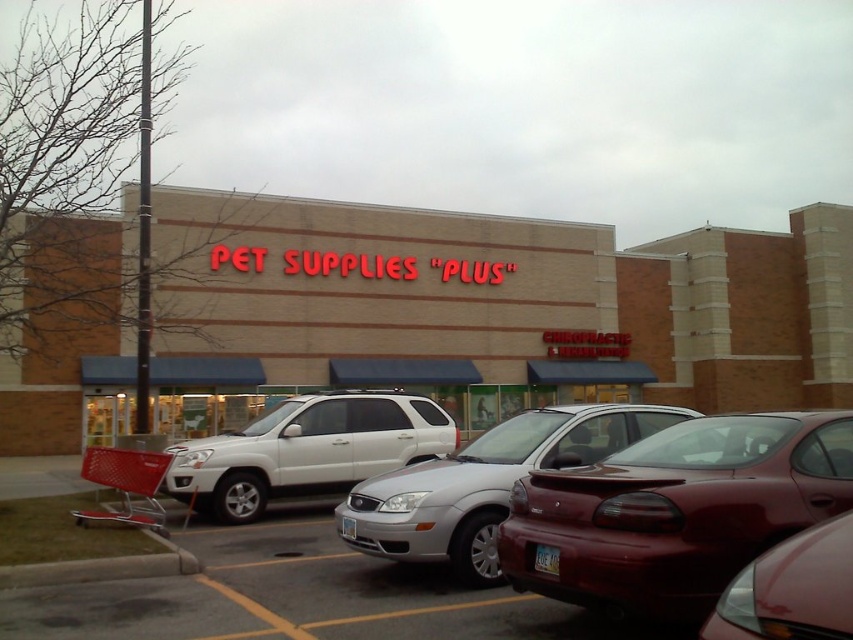
Is the position of shiny red sedan at center less distant than that of white matte suv at center?

Yes, shiny red sedan at center is closer to the viewer.

Is point (619, 532) positioned after point (253, 481)?

That is False.

Identify the location of shiny red sedan at center. (675, 512).

Is silver metallic sedan at center wider than red plastic shopping cart at lower left?

A: Incorrect, silver metallic sedan at center's width does not surpass red plastic shopping cart at lower left's.

Does silver metallic sedan at center have a smaller size compared to red plastic shopping cart at lower left?

Yes, silver metallic sedan at center is smaller than red plastic shopping cart at lower left.

Who is more distant from viewer, (x=347, y=515) or (x=73, y=513)?

Point (x=73, y=513)

At what (x,y) coordinates should I click in order to perform the action: click on silver metallic sedan at center. Please return your answer as a coordinate pair (x, y). Looking at the image, I should click on point(485,483).

In the scene shown: Is beige brick building at center thinner than red plastic shopping cart at lower left?

Incorrect, beige brick building at center's width is not less than red plastic shopping cart at lower left's.

What do you see at coordinates (498, 308) in the screenshot?
I see `beige brick building at center` at bounding box center [498, 308].

In order to click on beige brick building at center in this screenshot , I will do `click(498, 308)`.